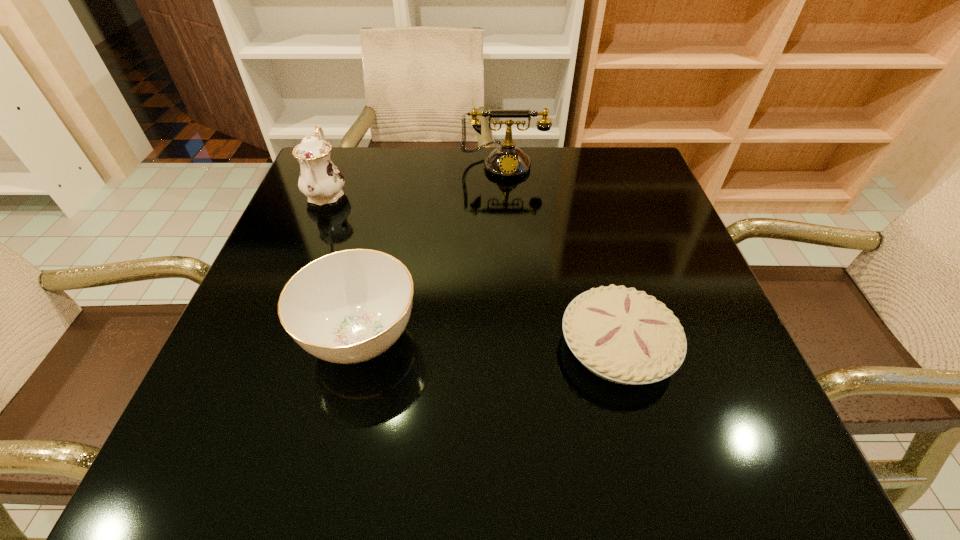
This screenshot has height=540, width=960. In order to click on telephone in this screenshot , I will do pos(507,161).

This screenshot has height=540, width=960. What are the coordinates of `the left chinaware` in the screenshot? It's located at (320, 180).

Locate an element on the screen. The image size is (960, 540). the taller chinaware is located at coordinates (320, 180).

Find the location of `the second shortest object`. the second shortest object is located at coordinates (346, 307).

Where is `the shorter chinaware`? This screenshot has height=540, width=960. the shorter chinaware is located at coordinates (346, 307).

Identify the location of the shortest object. The height and width of the screenshot is (540, 960). (623, 335).

I want to click on vacant area situated on the dial of the telephone, so click(x=507, y=204).

The height and width of the screenshot is (540, 960). I want to click on vacant area located 0.210m on the front of the leftmost object, so click(291, 279).

Find the location of a particular element. Image resolution: width=960 pixels, height=540 pixels. free space located 0.240m on the right of the second object from left to right is located at coordinates (557, 338).

This screenshot has height=540, width=960. I want to click on free space located on the right of the shortest object, so click(x=716, y=346).